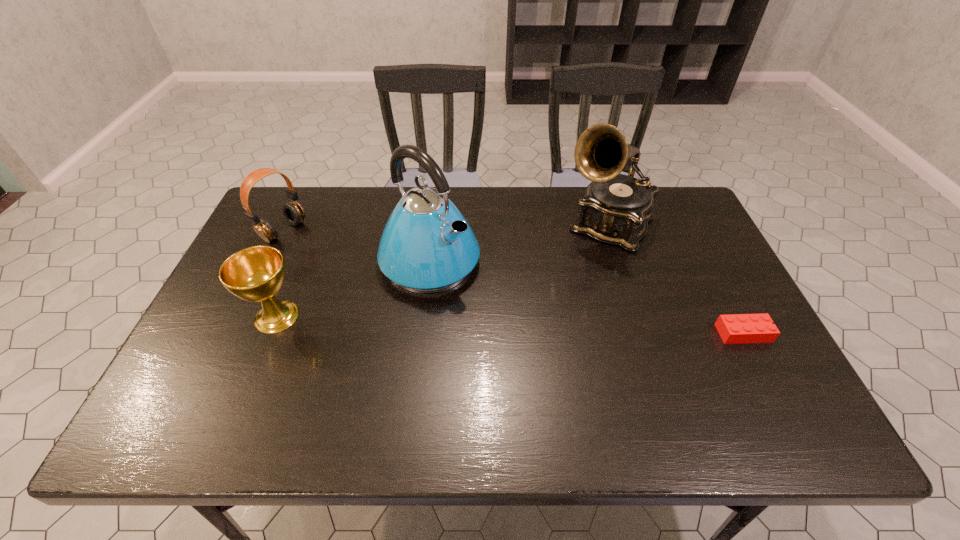
This screenshot has width=960, height=540. In order to click on chalice that is at the left edge in this screenshot , I will do click(256, 274).

The image size is (960, 540). What are the coordinates of `headset that is positioned at the left edge` in the screenshot? It's located at (293, 212).

At what (x,y) coordinates should I click in order to perform the action: click on Lego at the right edge. Please return your answer as a coordinate pair (x, y). The height and width of the screenshot is (540, 960). Looking at the image, I should click on pos(736,328).

At what (x,y) coordinates should I click in order to perform the action: click on phonograph record present at the right edge. Please return your answer as a coordinate pair (x, y). Looking at the image, I should click on click(616, 208).

Identify the location of object present at the far left corner. The height and width of the screenshot is (540, 960). (293, 212).

Locate an element on the screen. This screenshot has height=540, width=960. object that is at the far right corner is located at coordinates (616, 208).

Identify the location of free region at the far edge of the desktop. Image resolution: width=960 pixels, height=540 pixels. (333, 220).

Locate an element on the screen. The image size is (960, 540). vacant space at the near edge is located at coordinates (492, 390).

In the image, there is a desktop. Where is `free region at the left edge`? This screenshot has height=540, width=960. free region at the left edge is located at coordinates (286, 244).

Where is `free space at the right edge of the desktop`? This screenshot has width=960, height=540. free space at the right edge of the desktop is located at coordinates (719, 256).